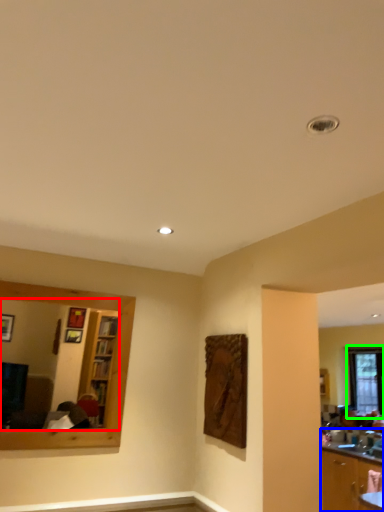
Question: Considering the real-world distances, which object is closest to mirror (highlighted by a red box)? cabinetry (highlighted by a blue box) or window (highlighted by a green box).

Choices:
 (A) cabinetry
 (B) window

Answer: (A)